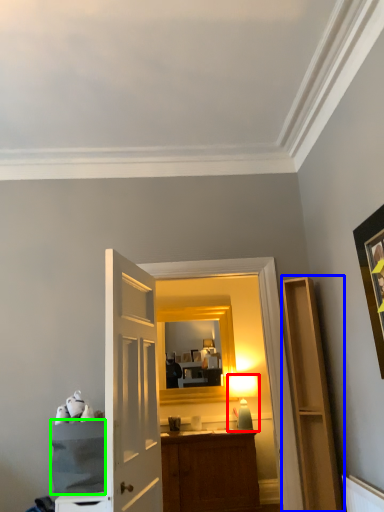
Question: Considering the real-world distances, which object is closest to table lamp (highlighted by a red box)? cabinetry (highlighted by a blue box) or cabinetry (highlighted by a green box).

Choices:
 (A) cabinetry
 (B) cabinetry

Answer: (A)